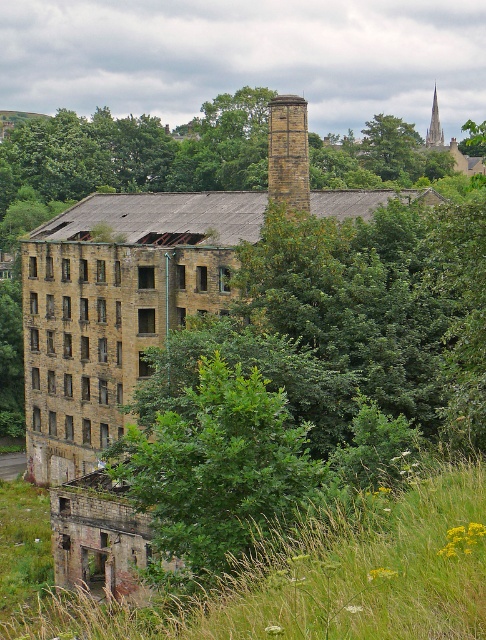
Question: Does brown brick chimney at center have a larger size compared to smooth stone spire at upper right?

Choices:
 (A) no
 (B) yes

Answer: (A)

Question: Which is nearer to the green leafy tree at center?

Choices:
 (A) smooth stone spire at upper right
 (B) brown brick chimney at center

Answer: (A)

Question: Among these points, which one is farthest from the camera?

Choices:
 (A) (296, 145)
 (B) (470, 138)

Answer: (B)

Question: Observing the image, what is the correct spatial positioning of brown brick chimney at center in reference to green leafy tree at center?

Choices:
 (A) below
 (B) above

Answer: (A)

Question: Can you confirm if green leafy tree at center is positioned to the right of smooth stone spire at upper right?

Choices:
 (A) yes
 (B) no

Answer: (A)

Question: Which point is farther from the camera taking this photo?

Choices:
 (A) (480, 125)
 (B) (284, 182)

Answer: (A)